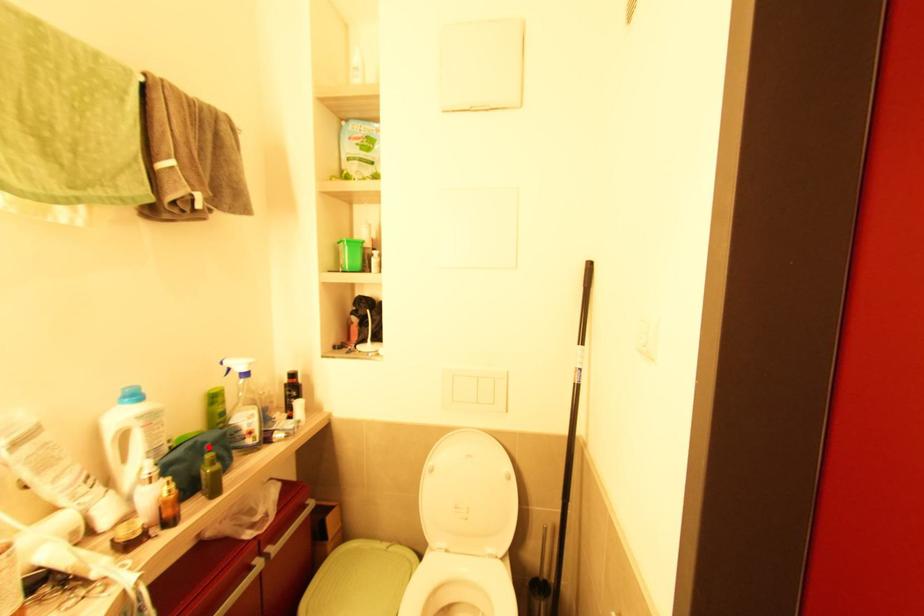
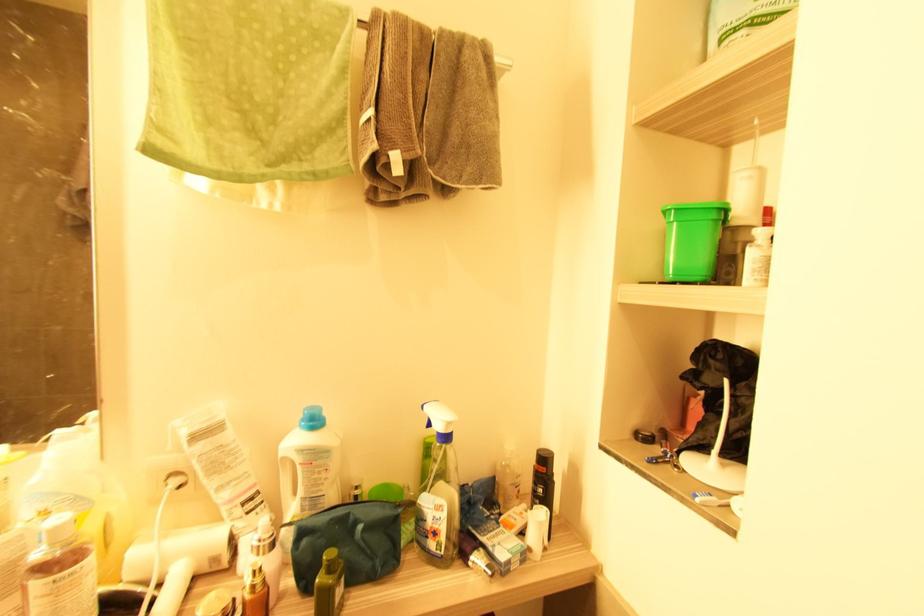
Where in the second image is the point corresponding to the highlighted location from the first image?

(361, 529)